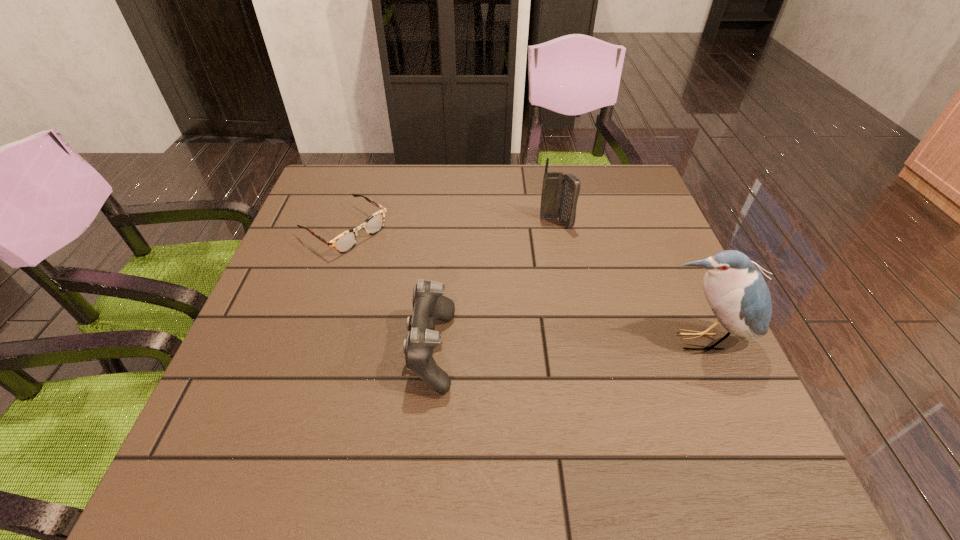
Identify the location of blank region between the spectacles and the second object from right to left. The image size is (960, 540). (450, 227).

Image resolution: width=960 pixels, height=540 pixels. What are the coordinates of `vacant area between the third object from right to left and the spectacles` in the screenshot? It's located at (388, 291).

Identify the location of free space that is in between the third object from left to right and the bird. (629, 282).

At what (x,y) coordinates should I click in order to perform the action: click on empty space that is in between the bird and the third tallest object. Please return your answer as a coordinate pair (x, y). This screenshot has width=960, height=540. Looking at the image, I should click on (566, 346).

Locate an element on the screen. The height and width of the screenshot is (540, 960). empty space that is in between the shortest object and the third shortest object is located at coordinates (450, 227).

Identify the location of empty location between the bird and the cellular telephone. (629, 282).

Image resolution: width=960 pixels, height=540 pixels. In order to click on empty location between the cellular telephone and the spectacles in this screenshot , I will do `click(450, 227)`.

The image size is (960, 540). I want to click on vacant space in between the second object from left to right and the third object from left to right, so click(x=493, y=287).

The width and height of the screenshot is (960, 540). I want to click on free space that is in between the leftmost object and the third object from left to right, so click(450, 227).

Where is `vacant area that lies between the spectacles and the second tallest object`? The width and height of the screenshot is (960, 540). vacant area that lies between the spectacles and the second tallest object is located at coordinates (450, 227).